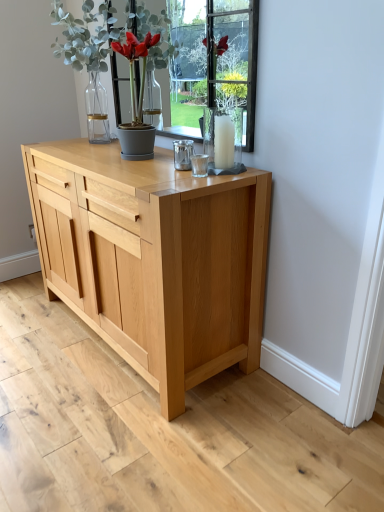
Identify the location of free space to the left of clear glass candle at center. (164, 172).